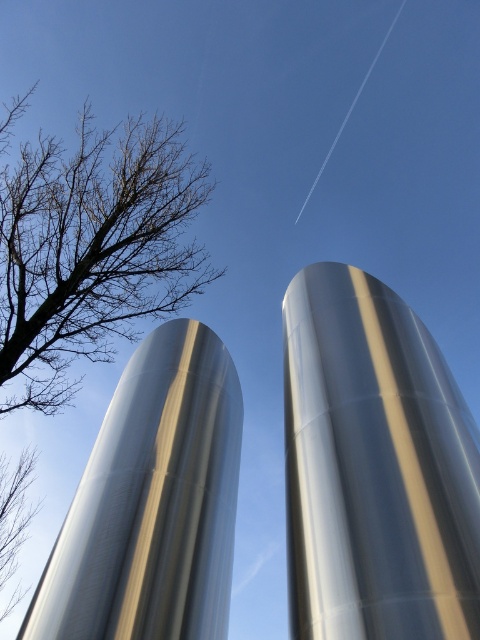
You are standing at the point marked at coordinate point (175, 336). You want to walk to the nearest cylinder. How far will you have to walk?

The distance between the point marked at coordinate point (175, 336) and the nearest cylinder is 15.52 feet, so you will have to walk 15.52 feet.

You are an astronaut preparing for a space mission and see the image. You notice a point marked at coordinates (374, 467). What object does this point correspond to?

The point at coordinates (374, 467) corresponds to the silver metallic rocket at center.